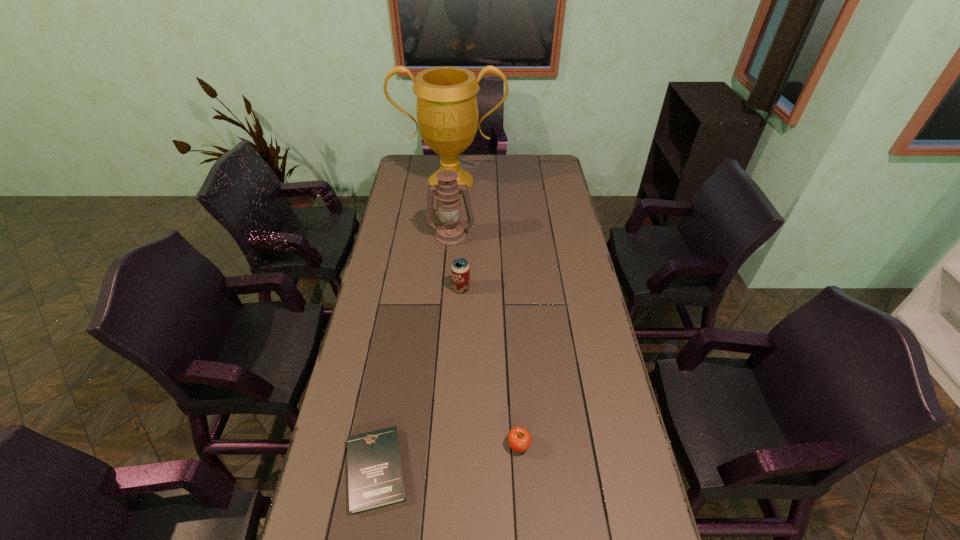
Locate an element on the screen. This screenshot has height=540, width=960. vacant space located 0.070m on the back of the beer can is located at coordinates (462, 269).

You are a GUI agent. You are given a task and a screenshot of the screen. Output one action in this format:
    pyautogui.click(x=<x>, y=<y>)
    Task: Click on the vacant region located 0.290m on the left of the fourth tallest object
    Image resolution: width=960 pixels, height=540 pixels.
    Given the screenshot: What is the action you would take?
    pyautogui.click(x=400, y=445)

Where is `blank area located on the right of the shortest object`? The image size is (960, 540). blank area located on the right of the shortest object is located at coordinates (556, 470).

Locate an element on the screen. The width and height of the screenshot is (960, 540). object that is positioned at the far edge is located at coordinates (447, 114).

Find the location of a particular element. The image size is (960, 540). trophy that is at the left edge is located at coordinates (447, 114).

At what (x,y) coordinates should I click in order to perform the action: click on book at the left edge. Please return your answer as a coordinate pair (x, y). Looking at the image, I should click on (375, 477).

Where is `object situated at the far left corner`? The image size is (960, 540). object situated at the far left corner is located at coordinates (447, 114).

The width and height of the screenshot is (960, 540). Identify the location of vacant space at the far edge of the desktop. (494, 157).

The width and height of the screenshot is (960, 540). Identify the location of free space at the left edge. (413, 244).

In the image, there is a desktop. Where is `vacant space at the right edge`? The width and height of the screenshot is (960, 540). vacant space at the right edge is located at coordinates (592, 359).